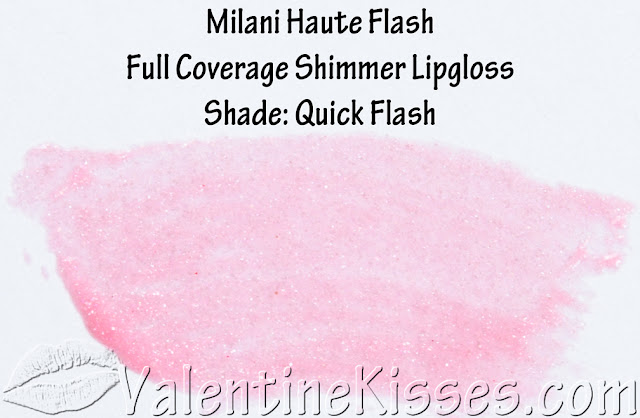
You are a GUI agent. You are given a task and a screenshot of the screen. Output one action in this format:
    pyautogui.click(x=<x>, y=<y>)
    Task: Click on the shade
    
    Given the screenshot: What is the action you would take?
    pyautogui.click(x=249, y=121)